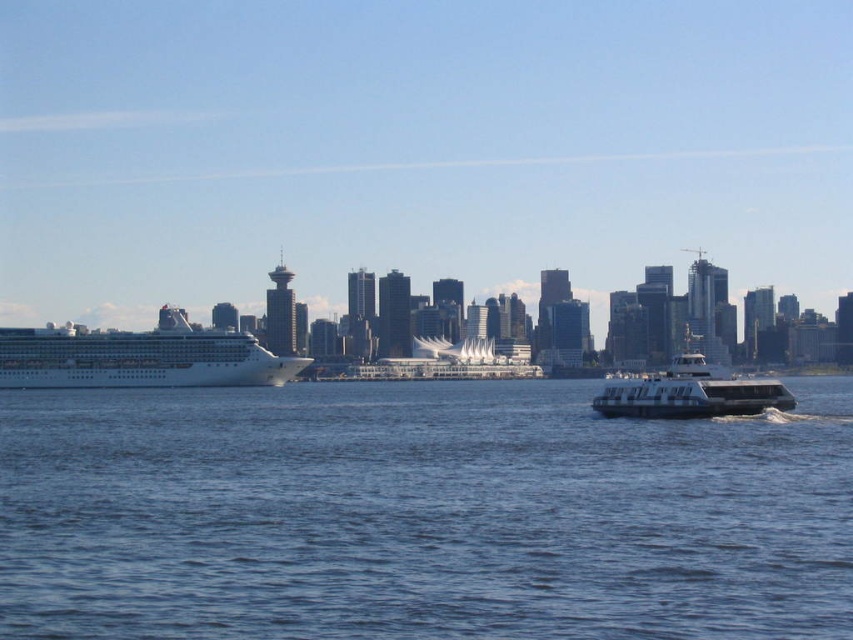
Question: Which object is closer to the camera taking this photo?

Choices:
 (A) white glossy building at center
 (B) metallic gray ferry at lower right
 (C) white glossy cruise ship at left
 (D) blue water at center

Answer: (D)

Question: Is white glossy cruise ship at left thinner than white glossy building at center?

Choices:
 (A) no
 (B) yes

Answer: (A)

Question: Which point appears closest to the camera in this image?

Choices:
 (A) pos(532,477)
 (B) pos(22,364)
 (C) pos(726,397)

Answer: (A)

Question: Is white glossy cruise ship at left positioned at the back of white glossy building at center?

Choices:
 (A) yes
 (B) no

Answer: (B)

Question: Is blue water at center positioned at the back of metallic gray ferry at lower right?

Choices:
 (A) yes
 (B) no

Answer: (B)

Question: Which of the following is the farthest from the observer?

Choices:
 (A) white glossy cruise ship at left
 (B) metallic gray ferry at lower right

Answer: (B)